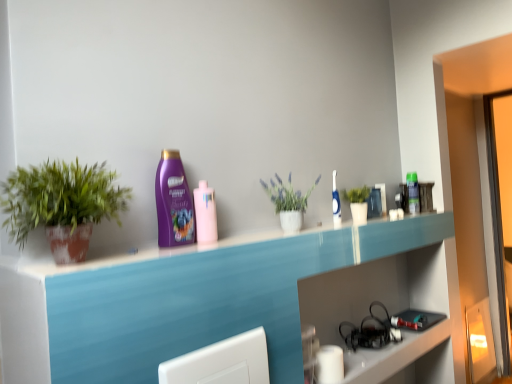
Question: Which direction should I rotate to look at pink glossy mouthwash at center, which is counted as the third mouthwash, starting from the right, — up or down?

Choices:
 (A) down
 (B) up

Answer: (A)

Question: Would you say pink glossy mouthwash at center, placed as the 1th mouthwash when sorted from left to right, is part of green matte plant at upper right, marked as the 3th houseplant in a front-to-back arrangement,'s contents?

Choices:
 (A) yes
 (B) no

Answer: (B)

Question: Does green matte plant at upper right, which is the 1th houseplant in back-to-front order, come behind pink glossy mouthwash at center, the third mouthwash from the back?

Choices:
 (A) yes
 (B) no

Answer: (A)

Question: Is green matte plant at upper right, which is the 1th houseplant in back-to-front order, with pink glossy mouthwash at center, the third mouthwash from the back?

Choices:
 (A) no
 (B) yes

Answer: (A)

Question: From a real-world perspective, does green matte plant at upper right, which is counted as the 3th houseplant, starting from the left, stand above pink glossy mouthwash at center, which is counted as the third mouthwash, starting from the right?

Choices:
 (A) no
 (B) yes

Answer: (A)

Question: Does green matte plant at upper right, which is counted as the 3th houseplant, starting from the left, have a greater height compared to pink glossy mouthwash at center, which is counted as the third mouthwash, starting from the right?

Choices:
 (A) yes
 (B) no

Answer: (B)

Question: Does green matte plant at upper right, placed as the 1th houseplant when sorted from right to left, have a greater width compared to pink glossy mouthwash at center, positioned as the first mouthwash in front-to-back order?

Choices:
 (A) yes
 (B) no

Answer: (A)

Question: Is white glossy toothbrush at upper center, positioned as the 2th mouthwash in left-to-right order, taller than purple glossy shampoo at center?

Choices:
 (A) yes
 (B) no

Answer: (B)

Question: From a real-world perspective, is white glossy toothbrush at upper center, which is the second mouthwash in back-to-front order, positioned under purple glossy shampoo at center based on gravity?

Choices:
 (A) yes
 (B) no

Answer: (A)

Question: Can you confirm if white glossy toothbrush at upper center, positioned as the 2th mouthwash in right-to-left order, is positioned to the left of purple glossy shampoo at center?

Choices:
 (A) yes
 (B) no

Answer: (B)

Question: Is white glossy toothbrush at upper center, marked as the second mouthwash in a front-to-back arrangement, thinner than purple glossy shampoo at center?

Choices:
 (A) yes
 (B) no

Answer: (A)

Question: Does white glossy toothbrush at upper center, positioned as the 2th mouthwash in right-to-left order, have a greater width compared to purple glossy shampoo at center?

Choices:
 (A) yes
 (B) no

Answer: (B)

Question: Does white glossy toothbrush at upper center, positioned as the 2th mouthwash in left-to-right order, have a lesser height compared to purple glossy shampoo at center?

Choices:
 (A) yes
 (B) no

Answer: (A)

Question: Can you confirm if green matte plant at left, the 3th houseplant in the back-to-front sequence, is positioned to the right of pink glossy mouthwash at center, the third mouthwash from the back?

Choices:
 (A) no
 (B) yes

Answer: (A)